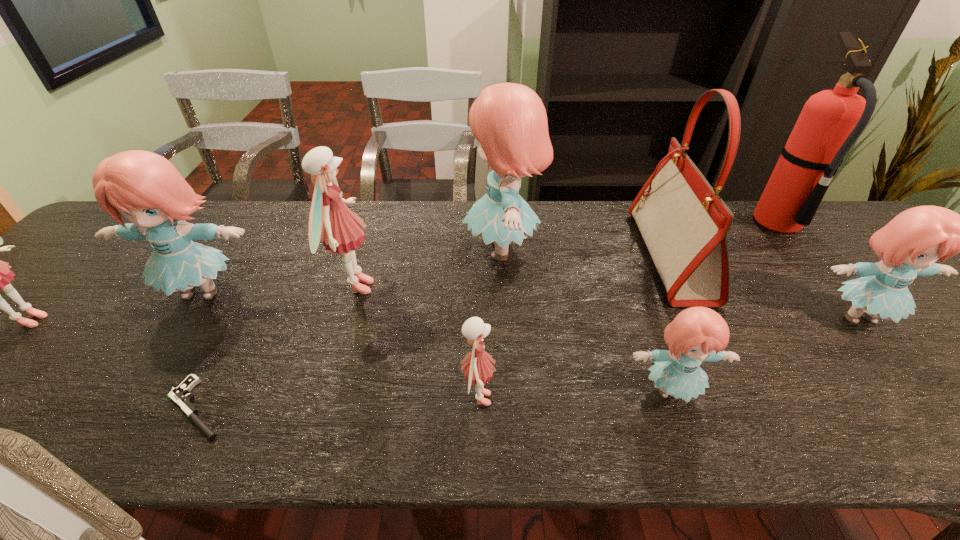
The width and height of the screenshot is (960, 540). Identify the location of red fire extinguisher. (830, 122).

In order to click on the tallest doll in this screenshot , I will do pos(509,120).

Locate an element on the screen. the biggest blue doll is located at coordinates (509, 120).

This screenshot has height=540, width=960. Identify the location of handbag. (684, 223).

At what (x,y) coordinates should I click in order to perform the action: click on the seventh object from right to left. Please return your answer as a coordinate pair (x, y). This screenshot has width=960, height=540. Looking at the image, I should click on (331, 221).

The width and height of the screenshot is (960, 540). I want to click on the second pink doll from right to left, so click(x=331, y=221).

Where is `the second doll from left to right`? the second doll from left to right is located at coordinates (146, 188).

The image size is (960, 540). Identify the location of the third smallest blue doll. (146, 188).

At what (x,y) coordinates should I click in order to perform the action: click on the second smallest blue doll. Please return your answer as a coordinate pair (x, y). The height and width of the screenshot is (540, 960). Looking at the image, I should click on (908, 246).

The height and width of the screenshot is (540, 960). What are the coordinates of `the rightmost blue doll` in the screenshot? It's located at (908, 246).